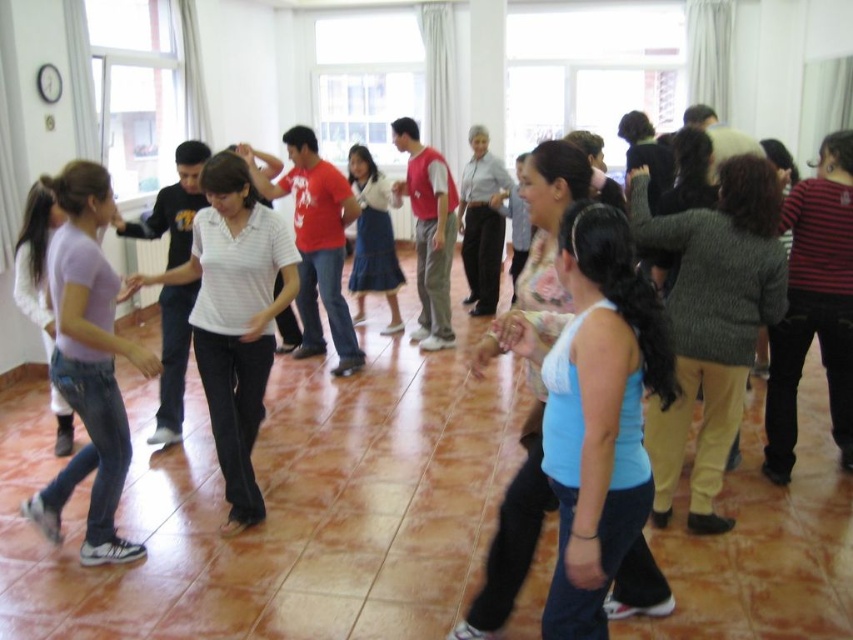
Which of these two, white matte shirt at center or denim skirt at center, stands shorter?

denim skirt at center is shorter.

Is point (242, 298) positioned before point (374, 163)?

That is True.

Image resolution: width=853 pixels, height=640 pixels. Find the location of `white matte shirt at center`. white matte shirt at center is located at coordinates (234, 316).

At what (x,y) coordinates should I click in order to perform the action: click on white matte shirt at center. Please return your answer as a coordinate pair (x, y). This screenshot has width=853, height=640. Looking at the image, I should click on (234, 316).

Between point (62, 291) and point (381, 236), which one is positioned behind?

Positioned behind is point (381, 236).

Looking at this image, is the position of light purple cotton t-shirt at left more distant than that of denim skirt at center?

No, it is in front of denim skirt at center.

The height and width of the screenshot is (640, 853). I want to click on light purple cotton t-shirt at left, so click(88, 364).

You are a GUI agent. You are given a task and a screenshot of the screen. Output one action in this format:
    pyautogui.click(x=<x>, y=<y>)
    Task: Click on the light purple cotton t-shirt at left
    Image resolution: width=853 pixels, height=640 pixels.
    Given the screenshot: What is the action you would take?
    pyautogui.click(x=88, y=364)

In order to click on white matte shirt at center in this screenshot , I will do `click(234, 316)`.

Based on the photo, is white matte shirt at center thinner than light purple cotton t-shirt at left?

Yes.

Find the location of a particular element. Image resolution: width=853 pixels, height=640 pixels. white matte shirt at center is located at coordinates (234, 316).

The width and height of the screenshot is (853, 640). Find the location of `white matte shirt at center`. white matte shirt at center is located at coordinates (234, 316).